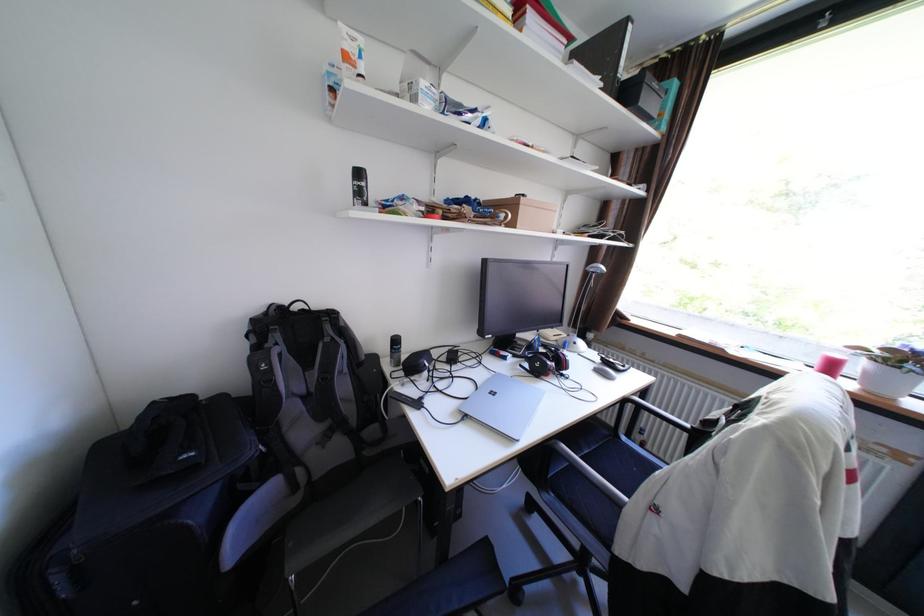
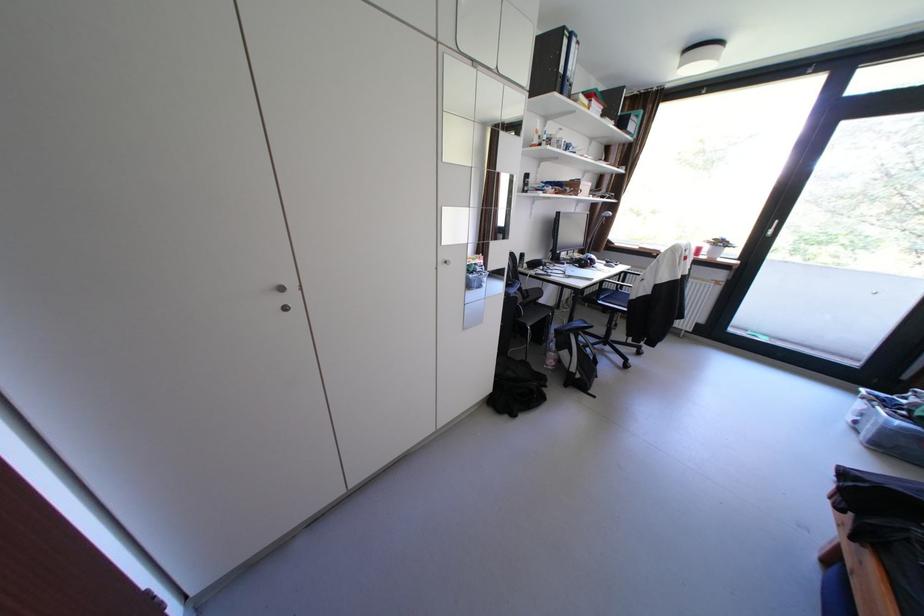
Where in the second image is the point corresponding to point (515, 358) from the first image?

(574, 264)